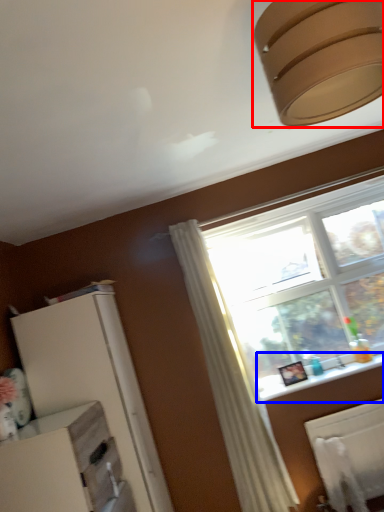
Question: Which object appears closest to the camera in this image, lamp (highlighted by a red box) or window sill (highlighted by a blue box)?

Choices:
 (A) lamp
 (B) window sill

Answer: (A)